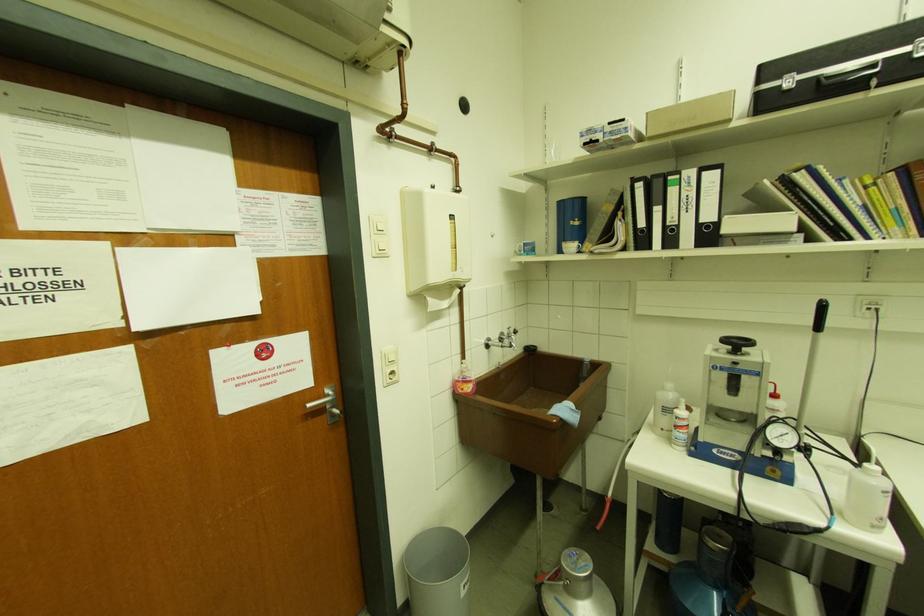
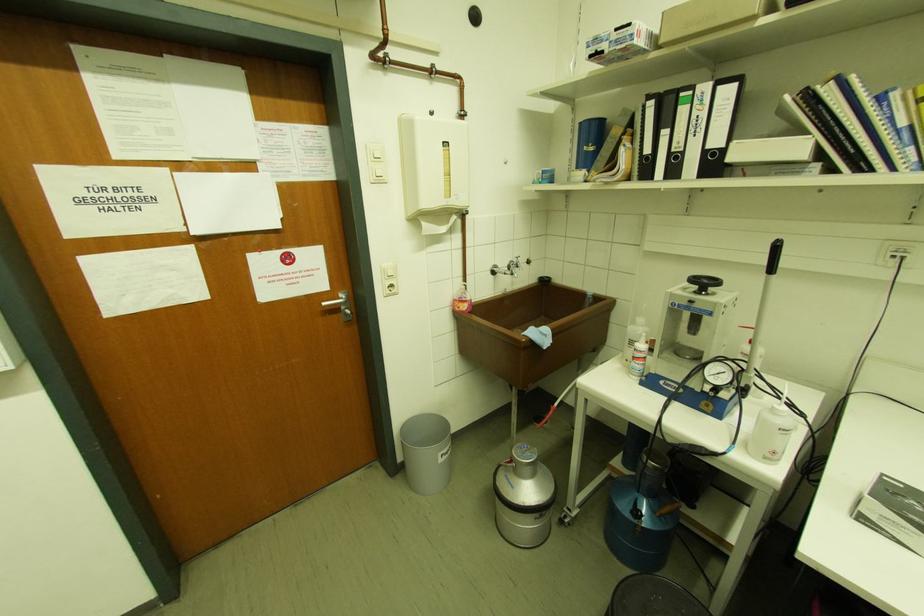
In the second image, find the point that corresponds to [880,530] in the first image.

(772, 460)